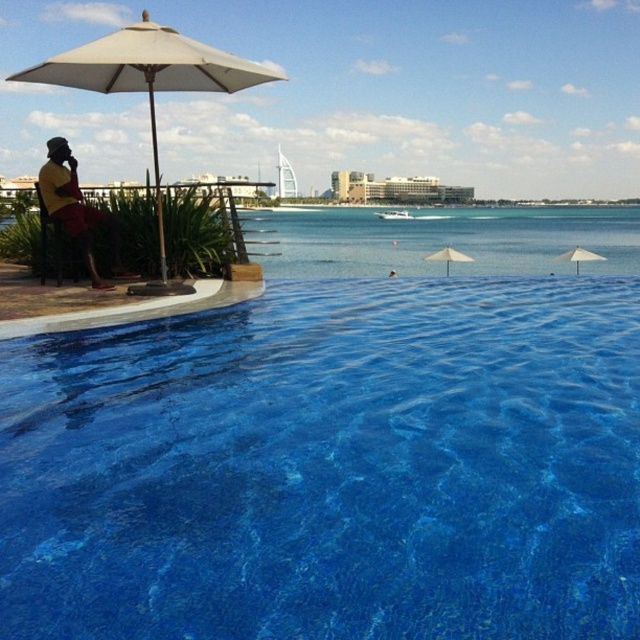
Question: Does blue glossy water at center appear under wooden chair at left?

Choices:
 (A) yes
 (B) no

Answer: (A)

Question: Which point is farther to the camera?

Choices:
 (A) beige fabric umbrella at upper left
 (B) yellow fabric shirt at left

Answer: (B)

Question: Where is beige fabric umbrella at upper left located in relation to yellow fabric shirt at left in the image?

Choices:
 (A) right
 (B) left

Answer: (A)

Question: Which of the following is the closest to the observer?

Choices:
 (A) (424, 506)
 (B) (96, 224)
 (C) (38, 77)

Answer: (A)

Question: Where is transparent glass water at center located in relation to wooden chair at left in the image?

Choices:
 (A) below
 (B) above

Answer: (B)

Question: Which object appears closest to the camera in this image?

Choices:
 (A) beige fabric umbrella at upper left
 (B) transparent glass water at center
 (C) white fabric umbrella at upper center

Answer: (A)